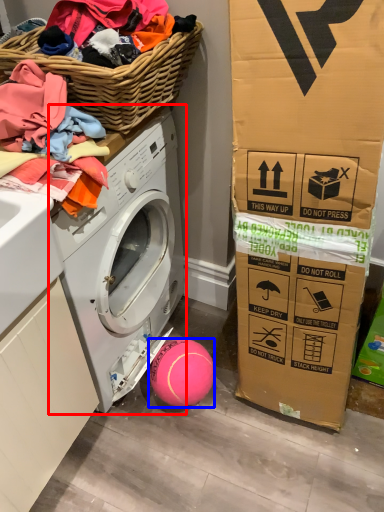
Question: Which of the following is the farthest to the observer, washing machine (highlighted by a red box) or ball (highlighted by a blue box)?

Choices:
 (A) washing machine
 (B) ball

Answer: (B)